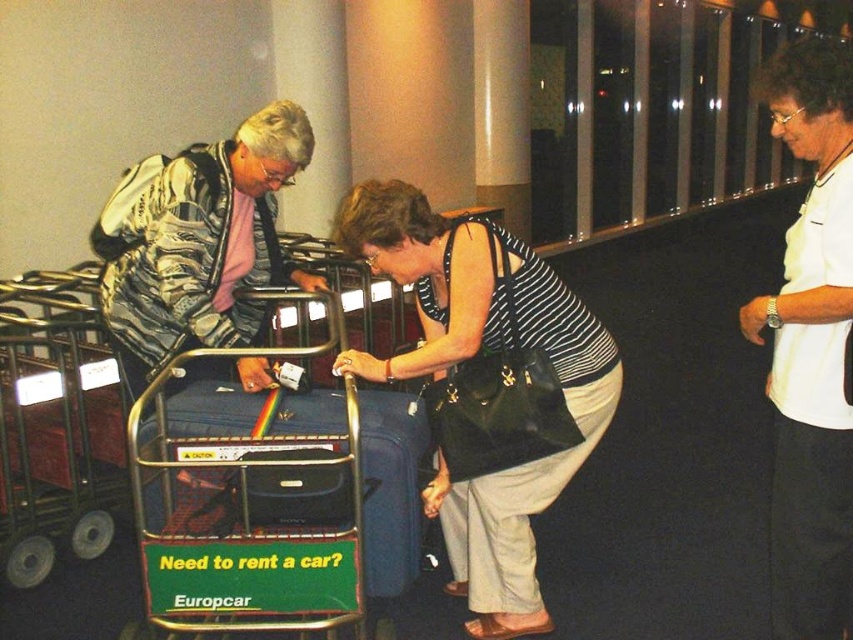
Question: Which of the following is the closest to the observer?

Choices:
 (A) blue fabric suitcase at center
 (B) striped fabric top at center
 (C) white smooth shirt at right

Answer: (C)

Question: Which point appears closest to the camera in this image?

Choices:
 (A) (375, 257)
 (B) (3, 451)
 (C) (387, 516)

Answer: (C)

Question: Can you confirm if camouflage jacket at left is wider than blue fabric suitcase at center?

Choices:
 (A) no
 (B) yes

Answer: (A)

Question: Is striped fabric top at center further to camera compared to blue fabric suitcase at center?

Choices:
 (A) no
 (B) yes

Answer: (B)

Question: Does camouflage jacket at left have a greater width compared to blue fabric suitcase at center?

Choices:
 (A) no
 (B) yes

Answer: (A)

Question: Among these points, which one is nearest to the camera?

Choices:
 (A) (776, 310)
 (B) (524, 316)
 (C) (235, 179)
 (D) (0, 529)

Answer: (A)